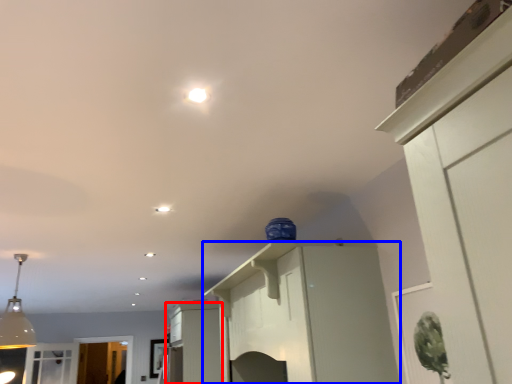
Question: Which object appears closest to the camera in this image, cabinetry (highlighted by a red box) or cabinetry (highlighted by a blue box)?

Choices:
 (A) cabinetry
 (B) cabinetry

Answer: (B)